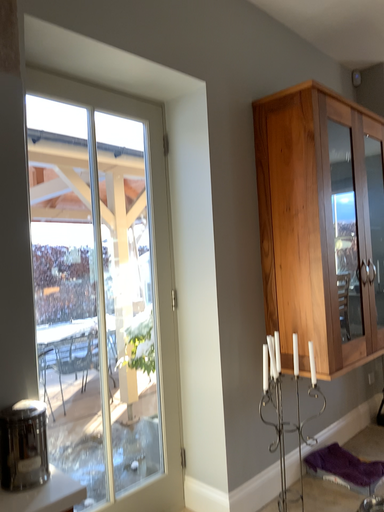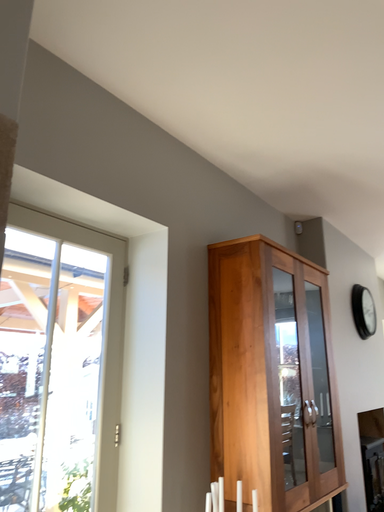
Question: Which way did the camera rotate in the video?

Choices:
 (A) rotated downward
 (B) rotated upward

Answer: (B)